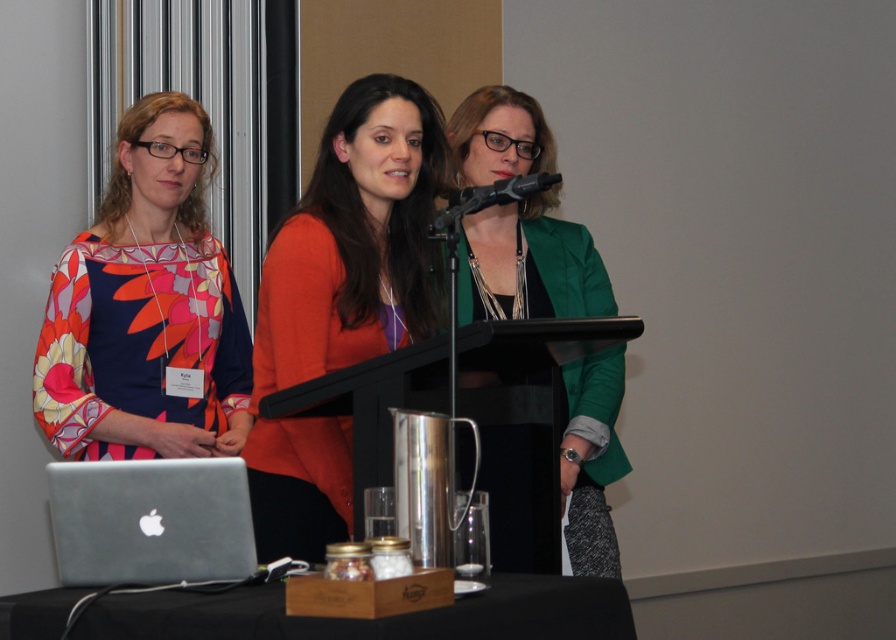
You are standing at the back of the room and want to walk to the point that is closer to the front. Which point should you go to, point (x=208, y=538) or point (x=520, y=192)?

Point (x=208, y=538) is in front of point (x=520, y=192), so you should go to point (x=208, y=538).

You are standing at the back of the room and want to walk to the podium. There are two points marked on the floor in front of you. The first point is at coordinate point(392, 204) and the second point is at coordinate point(496, 99). Which point should you step on first to reach the podium quickly?

You should step on point(392, 204) first because it is in front of point(496, 99), so it is closer to the podium.

You are a photographer at the event and want to capture a clear photo of the orange fabric sweater at center and the green matte blazer at center. Which one should you focus on first to ensure both are in focus?

You should focus on the orange fabric sweater at center first since it is closer to the viewer than the green matte blazer at center, allowing the camera to adjust focus for both.